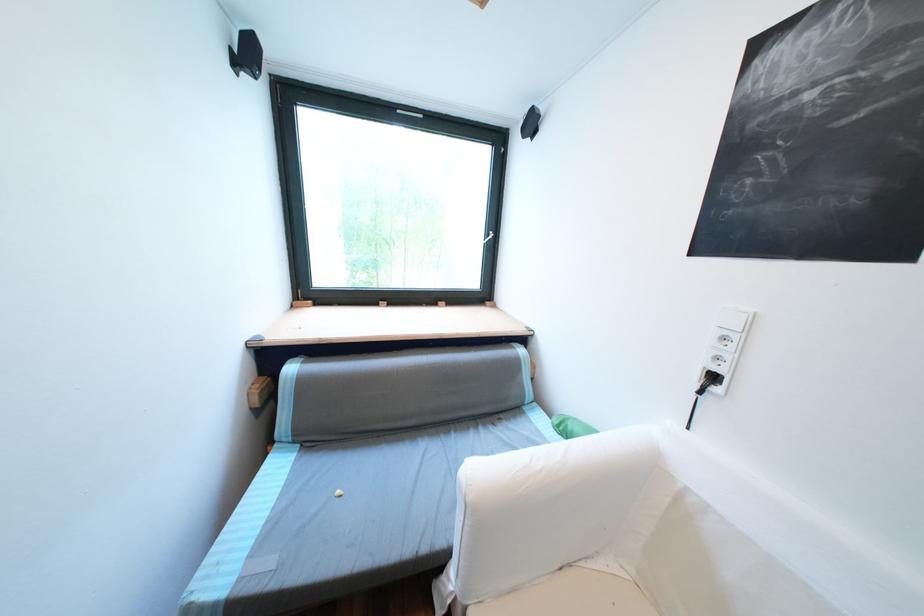
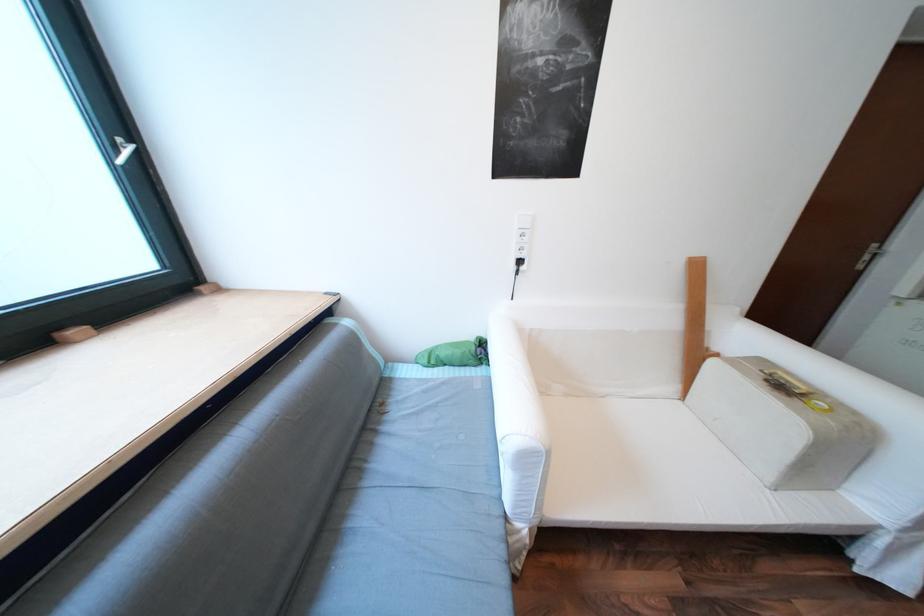
The first image is from the beginning of the video and the second image is from the end. How did the camera likely rotate when shooting the video?

The camera rotated toward right-down.